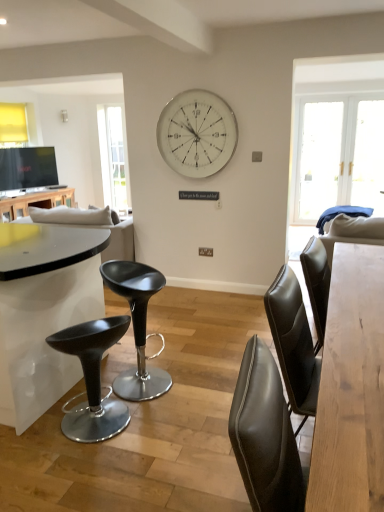
The height and width of the screenshot is (512, 384). What do you see at coordinates (114, 158) in the screenshot?
I see `clear glass window at left` at bounding box center [114, 158].

Image resolution: width=384 pixels, height=512 pixels. What do you see at coordinates (351, 388) in the screenshot?
I see `light brown wooden table at center, which is the 1th table from bottom to top` at bounding box center [351, 388].

Measure the distance between point (x=339, y=316) and camera.

Point (x=339, y=316) and camera are 1.75 meters apart.

This screenshot has height=512, width=384. Find the location of `matte black stool at lower left`. matte black stool at lower left is located at coordinates (92, 379).

The width and height of the screenshot is (384, 512). Describe the element at coordinates (197, 133) in the screenshot. I see `white metallic wall clock at upper center` at that location.

You are a GUI agent. You are given a task and a screenshot of the screen. Output one action in this format:
    pyautogui.click(x=<x>, y=<y>)
    Task: Click on the matte black stool at center
    
    Given the screenshot: What is the action you would take?
    pyautogui.click(x=137, y=327)

Is white glossy table at left, which ranks as the second table in front-to-back order, positioned with its back to clear glass window at left?

No, clear glass window at left is not at the back of white glossy table at left, which ranks as the second table in front-to-back order.

Which point is more forward, (4, 200) or (100, 133)?

The point (4, 200) is closer.

I want to click on table that is the 1st one when counting downward from the clear glass window at left (from the image's perspective), so click(36, 201).

From a real-world perspective, is white glossy table at left, marked as the second table in a bottom-to-top arrangement, positioned under clear glass window at left based on gravity?

Yes, from a real-world perspective, white glossy table at left, marked as the second table in a bottom-to-top arrangement, is under clear glass window at left.

Considering the relative sizes of matte black stool at lower left and white glossy table at left, which is counted as the first table, starting from the left, in the image provided, is matte black stool at lower left thinner than white glossy table at left, which is counted as the first table, starting from the left,?

Yes, matte black stool at lower left is thinner than white glossy table at left, which is counted as the first table, starting from the left.

Which object is closer to the camera, matte black stool at lower left or white glossy table at left, marked as the second table in a bottom-to-top arrangement?

matte black stool at lower left is more forward.

Find the location of a particular element. The image size is (384, 512). bar stool beneath the white glossy table at left, marked as the second table in a bottom-to-top arrangement (from a real-world perspective) is located at coordinates (92, 379).

Measure the distance from light brown wooden table at center, the 2th table viewed from the left, to white glossy table at left, marked as the second table in a bottom-to-top arrangement.

light brown wooden table at center, the 2th table viewed from the left, and white glossy table at left, marked as the second table in a bottom-to-top arrangement, are 3.85 meters apart.

In terms of width, does light brown wooden table at center, which is the 2th table from top to bottom, look wider or thinner when compared to white glossy table at left, the 1th table viewed from the back?

light brown wooden table at center, which is the 2th table from top to bottom, is thinner than white glossy table at left, the 1th table viewed from the back.

Is light brown wooden table at center, which is the 1th table from bottom to top, situated inside white glossy table at left, the 2th table when ordered from right to left, or outside?

light brown wooden table at center, which is the 1th table from bottom to top, cannot be found inside white glossy table at left, the 2th table when ordered from right to left.

Could you tell me if light brown wooden table at center, which is the 1th table from bottom to top, is turned towards white glossy table at left, the 1th table viewed from the back?

No, light brown wooden table at center, which is the 1th table from bottom to top, is not oriented towards white glossy table at left, the 1th table viewed from the back.

Does clear glass window at left have a lesser height compared to matte black stool at lower left?

Incorrect, the height of clear glass window at left does not fall short of that of matte black stool at lower left.

Are clear glass window at left and matte black stool at lower left located far from each other?

Yes.

Is clear glass window at left turned away from matte black stool at lower left?

No.

Which object is positioned more to the right, clear glass window at left or matte black stool at lower left?

Positioned to the right is matte black stool at lower left.

From the image's perspective, is matte black stool at center over white metallic wall clock at upper center?

Incorrect, from the image's perspective, matte black stool at center is lower than white metallic wall clock at upper center.

Between matte black stool at center and white metallic wall clock at upper center, which one is positioned in front?

matte black stool at center.

Is matte black stool at center bigger or smaller than white metallic wall clock at upper center?

In the image, matte black stool at center appears to be larger than white metallic wall clock at upper center.

From a real-world perspective, relative to matte black stool at lower left, is white metallic wall clock at upper center vertically above or below?

white metallic wall clock at upper center is above matte black stool at lower left.

How distant is white metallic wall clock at upper center from matte black stool at lower left?

white metallic wall clock at upper center is 2.20 meters from matte black stool at lower left.

Considering the relative positions of white metallic wall clock at upper center and matte black stool at lower left in the image provided, is white metallic wall clock at upper center to the left or to the right of matte black stool at lower left?

white metallic wall clock at upper center is positioned on matte black stool at lower left's right side.

Considering the sizes of objects white metallic wall clock at upper center and matte black stool at lower left in the image provided, who is smaller, white metallic wall clock at upper center or matte black stool at lower left?

Smaller between the two is white metallic wall clock at upper center.

Based on the photo, from the image's perspective, is white metallic wall clock at upper center on light brown wooden table at center, which is the first table from right to left?

Indeed, from the image's perspective, white metallic wall clock at upper center is shown above light brown wooden table at center, which is the first table from right to left.

Are white metallic wall clock at upper center and light brown wooden table at center, which ranks as the 1th table in front-to-back order, beside each other?

No, white metallic wall clock at upper center is not with light brown wooden table at center, which ranks as the 1th table in front-to-back order.

From a real-world perspective, is white metallic wall clock at upper center positioned under light brown wooden table at center, which ranks as the 1th table in front-to-back order, based on gravity?

Incorrect, from a real-world perspective, white metallic wall clock at upper center is higher than light brown wooden table at center, which ranks as the 1th table in front-to-back order.

Locate an element on the screen. The width and height of the screenshot is (384, 512). table that is the 2nd object directly below the white metallic wall clock at upper center (from a real-world perspective) is located at coordinates (351, 388).

The height and width of the screenshot is (512, 384). I want to click on the 1st table directly beneath the clear glass window at left (from a real-world perspective), so click(36, 201).

Where is `bar stool below the white glossy table at left, the 1th table viewed from the back (from the image's perspective)`? The width and height of the screenshot is (384, 512). bar stool below the white glossy table at left, the 1th table viewed from the back (from the image's perspective) is located at coordinates (92, 379).

Estimate the real-world distances between objects in this image. Which object is further from white glossy table at left, marked as the second table in a bottom-to-top arrangement, white metallic wall clock at upper center or clear glass window at left?

white metallic wall clock at upper center lies further to white glossy table at left, marked as the second table in a bottom-to-top arrangement, than the other object.

When comparing their distances from light brown wooden table at center, which is the 1th table from bottom to top, does matte black stool at center or white metallic wall clock at upper center seem closer?

Among the two, matte black stool at center is located nearer to light brown wooden table at center, which is the 1th table from bottom to top.

Considering their positions, is white metallic wall clock at upper center positioned further to matte black stool at center than white glossy table at left, which is counted as the first table, starting from the left?

white glossy table at left, which is counted as the first table, starting from the left, is further to matte black stool at center.

Which object lies further to the anchor point light brown wooden table at center, which is the 2th table from top to bottom, white metallic wall clock at upper center or clear glass window at left?

Among the two, clear glass window at left is located further to light brown wooden table at center, which is the 2th table from top to bottom.

Based on their spatial positions, is white metallic wall clock at upper center or matte black stool at lower left closer to light brown wooden table at center, which ranks as the 1th table in front-to-back order?

matte black stool at lower left.

Looking at the image, which one is located further to matte black stool at center, clear glass window at left or white metallic wall clock at upper center?

clear glass window at left lies further to matte black stool at center than the other object.

Looking at the image, which one is located closer to white metallic wall clock at upper center, matte black stool at center or matte black stool at lower left?

matte black stool at center.

Which object lies further to the anchor point matte black stool at center, white metallic wall clock at upper center or light brown wooden table at center, which is the 1th table from bottom to top?

Among the two, white metallic wall clock at upper center is located further to matte black stool at center.

Where is `bar stool located between light brown wooden table at center, which is the 2th table from top to bottom, and clear glass window at left in the depth direction`? The height and width of the screenshot is (512, 384). bar stool located between light brown wooden table at center, which is the 2th table from top to bottom, and clear glass window at left in the depth direction is located at coordinates (92, 379).

Locate an element on the screen. This screenshot has width=384, height=512. wall clock between light brown wooden table at center, which is the first table from right to left, and clear glass window at left from front to back is located at coordinates (197, 133).

Image resolution: width=384 pixels, height=512 pixels. Identify the location of wall clock located between matte black stool at center and white glossy table at left, which ranks as the second table in front-to-back order, in the depth direction. (197, 133).

Find the location of a particular element. The height and width of the screenshot is (512, 384). chair located between matte black stool at lower left and white glossy table at left, marked as the second table in a bottom-to-top arrangement, in the depth direction is located at coordinates (137, 327).